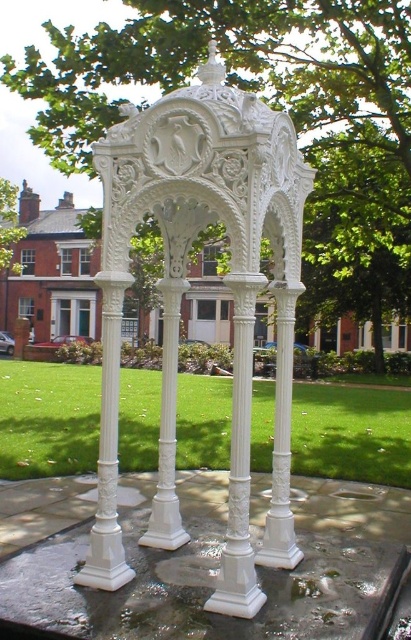
Question: Can you confirm if green leafy tree at center is positioned to the right of white glossy column at center?

Choices:
 (A) no
 (B) yes

Answer: (B)

Question: Among these objects, which one is farthest from the camera?

Choices:
 (A) white glossy column at center
 (B) green leafy tree at center

Answer: (B)

Question: Does white carved gazebo at center appear over green leafy tree at center?

Choices:
 (A) yes
 (B) no

Answer: (B)

Question: Which of the following is the closest to the observer?

Choices:
 (A) white glossy column at center
 (B) white carved gazebo at center
 (C) green leafy tree at center

Answer: (A)

Question: Does green leafy tree at center appear on the right side of white glossy column at center?

Choices:
 (A) no
 (B) yes

Answer: (B)

Question: Considering the real-world distances, which object is closest to the white glossy column at center?

Choices:
 (A) white carved gazebo at center
 (B) green leafy tree at center

Answer: (A)